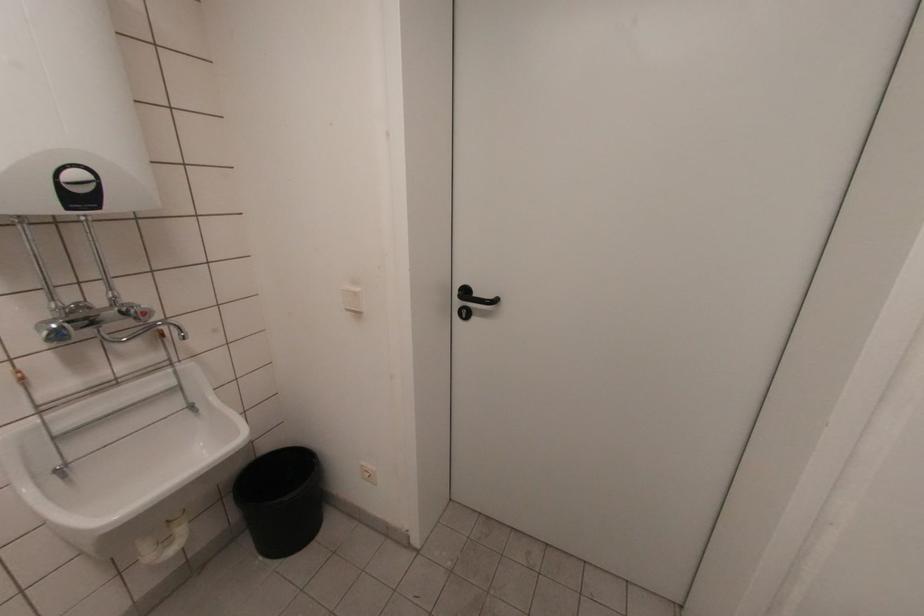
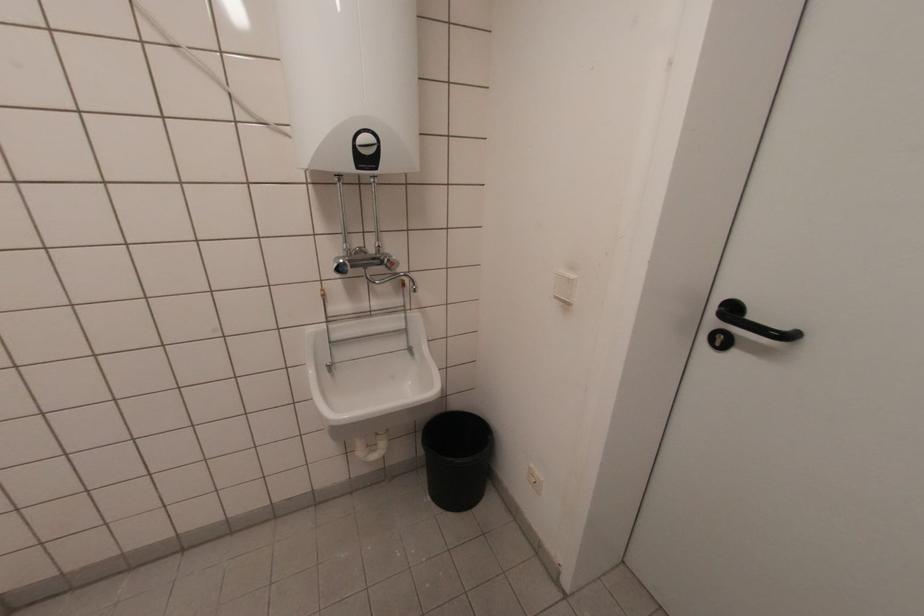
In the second image, find the point that corresponds to (51,318) in the first image.

(343, 254)